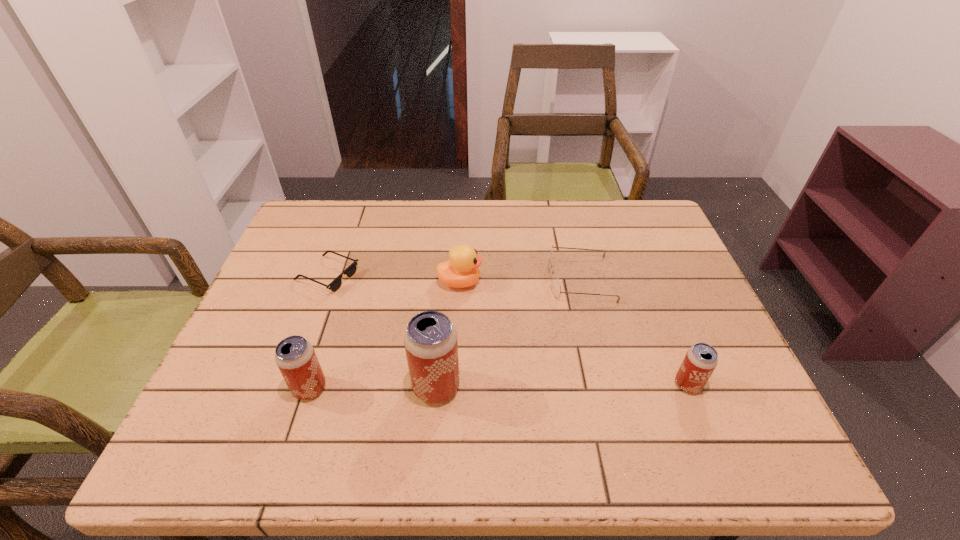
Where is `free space that is in between the duckling and the leftmost beer can`? This screenshot has height=540, width=960. free space that is in between the duckling and the leftmost beer can is located at coordinates (385, 335).

Where is `free space between the rightmost object and the second shortest object`? Image resolution: width=960 pixels, height=540 pixels. free space between the rightmost object and the second shortest object is located at coordinates (634, 332).

At what (x,y) coordinates should I click in order to perform the action: click on empty space that is in between the shortest object and the rightmost object. Please return your answer as a coordinate pair (x, y). Looking at the image, I should click on (508, 330).

You are a GUI agent. You are given a task and a screenshot of the screen. Output one action in this format:
    pyautogui.click(x=<x>, y=<y>)
    Task: Click on the unoccupied area between the duckling and the rightmost object
    The height and width of the screenshot is (540, 960).
    Given the screenshot: What is the action you would take?
    pyautogui.click(x=574, y=333)

The height and width of the screenshot is (540, 960). In order to click on unoccupied position between the tallest beer can and the second object from right to left in this screenshot , I will do `click(508, 333)`.

Identify which object is the third nearest to the duckling. Please provide its 2D coordinates. Your answer should be formatted as a tuple, i.e. [(x, y)], where the tuple contains the x and y coordinates of a point satisfying the conditions above.

[(430, 340)]

I want to click on the third closest object relative to the tallest object, so click(335, 285).

Locate an element on the screen. beer can identified as the closest to the spectacles is located at coordinates (701, 359).

Select which beer can appears as the closest to the leftmost beer can. Please provide its 2D coordinates. Your answer should be formatted as a tuple, i.e. [(x, y)], where the tuple contains the x and y coordinates of a point satisfying the conditions above.

[(430, 340)]

Identify the location of vacant space that satisfies the following two spatial constraints: 1. on the face of the duckling; 2. on the back side of the rightmost object. (455, 384).